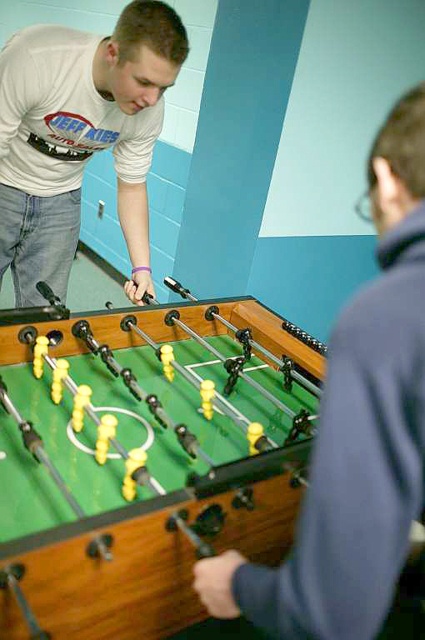
Is green wooden foosball table at center bigger than matte green foosball table at center?

Yes.

Is green wooden foosball table at center thinner than matte green foosball table at center?

Incorrect, green wooden foosball table at center's width is not less than matte green foosball table at center's.

In the scene shown: Who is more distant from viewer, (x=34, y=614) or (x=374, y=532)?

Point (x=34, y=614)

Identify the location of green wooden foosball table at center. The height and width of the screenshot is (640, 425). (141, 461).

Can you confirm if green wooden foosball table at center is wider than matte white t-shirt at upper left?

Indeed, green wooden foosball table at center has a greater width compared to matte white t-shirt at upper left.

The image size is (425, 640). Describe the element at coordinates (141, 461) in the screenshot. I see `green wooden foosball table at center` at that location.

Does point (17, 609) come in front of point (102, 104)?

Yes, it is.

Identify the location of green wooden foosball table at center. Image resolution: width=425 pixels, height=640 pixels. (141, 461).

Based on the photo, which of these two, matte green foosball table at center or matte white t-shirt at upper left, stands taller?

matte green foosball table at center

Is point (365, 291) positioned in front of point (13, 195)?

Yes.

Identify the location of matte green foosball table at center. This screenshot has width=425, height=640. (356, 432).